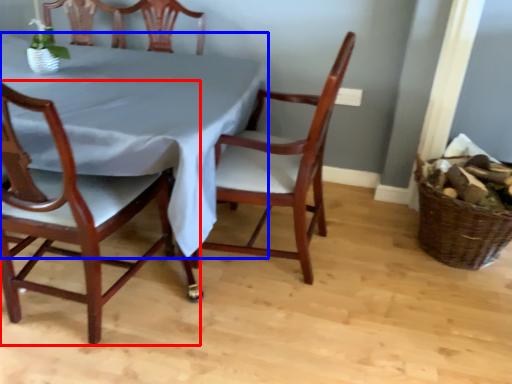
Question: Which point is further to the camera, chair (highlighted by a red box) or tablecloth (highlighted by a blue box)?

Choices:
 (A) chair
 (B) tablecloth

Answer: (B)